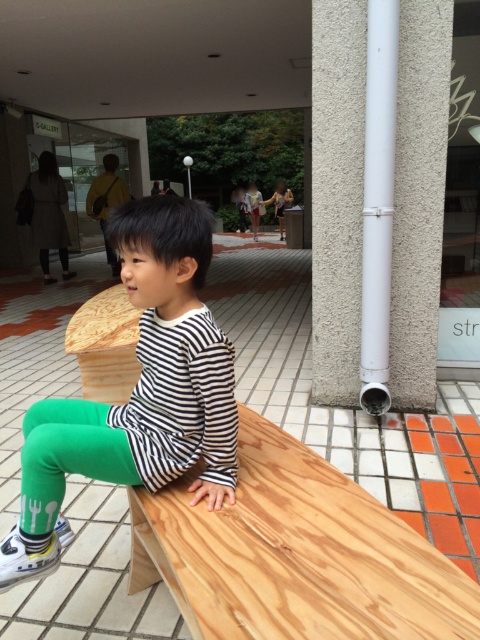
Between green cotton pants at center and green matte leggings at lower left, which one appears on the right side from the viewer's perspective?

From the viewer's perspective, green cotton pants at center appears more on the right side.

Is green cotton pants at center in front of green matte leggings at lower left?

No.

Is point (144, 259) less distant than point (106, 465)?

Yes, it is in front of point (106, 465).

Where is `green cotton pants at center`? Image resolution: width=480 pixels, height=640 pixels. green cotton pants at center is located at coordinates (137, 392).